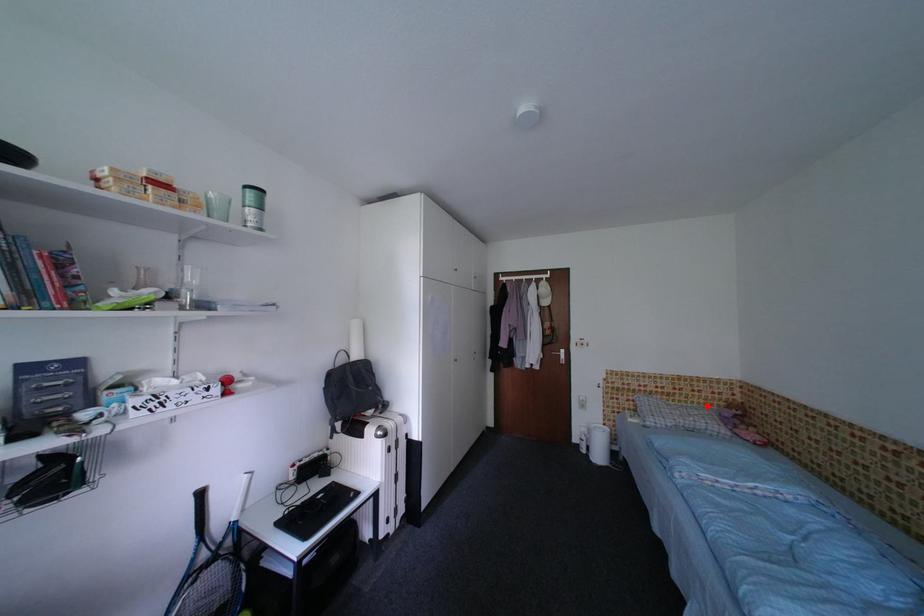
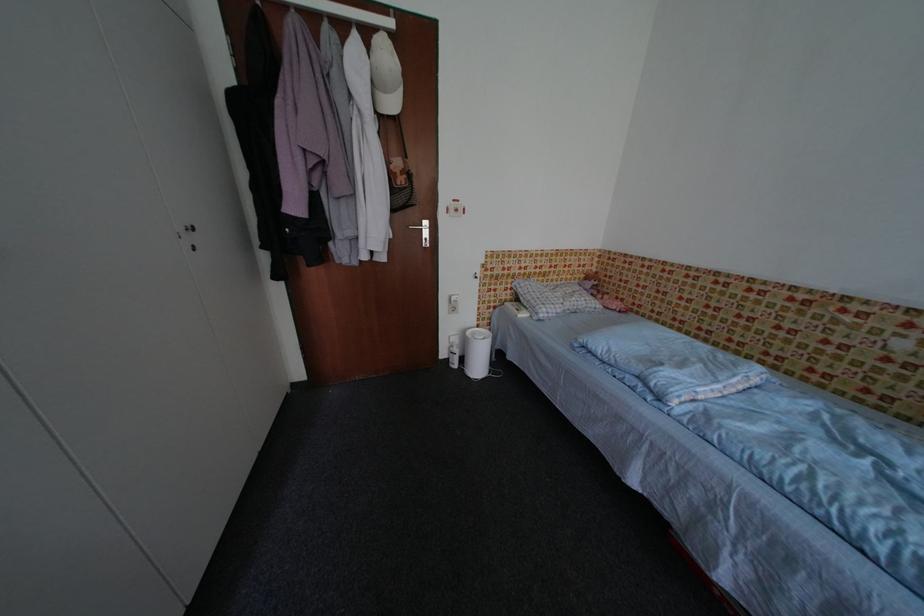
Find the pixel in the second image that matches the highlighted location in the first image.

(574, 282)